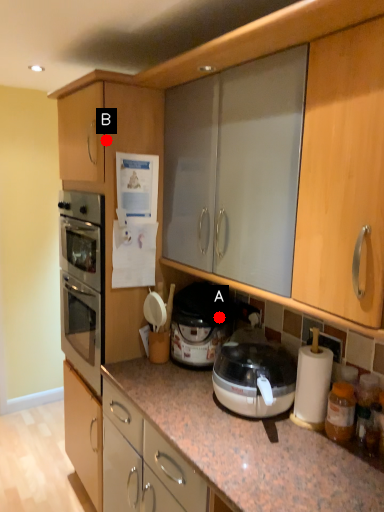
Question: Two points are circled on the image, labeled by A and B beside each circle. Which point is closer to the camera taking this photo?

Choices:
 (A) A is closer
 (B) B is closer

Answer: (B)